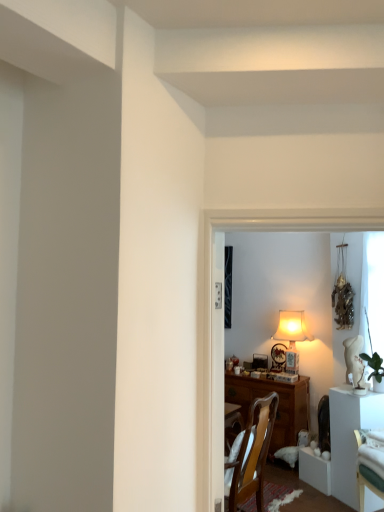
The image size is (384, 512). What do you see at coordinates (350, 437) in the screenshot? I see `white glossy table at right` at bounding box center [350, 437].

Where is `white glossy table at right`? white glossy table at right is located at coordinates (350, 437).

Measure the distance between white glossy table at right and camera.

3.02 meters.

This screenshot has height=512, width=384. Describe the element at coordinates (374, 365) in the screenshot. I see `green leafy plant at right` at that location.

The width and height of the screenshot is (384, 512). I want to click on green leafy plant at right, so click(374, 365).

In order to click on white glossy table at right in this screenshot , I will do `click(350, 437)`.

Visually, is green leafy plant at right positioned to the left or to the right of white glossy table at right?

From the image, it's evident that green leafy plant at right is to the right of white glossy table at right.

Between green leafy plant at right and white glossy table at right, which one is positioned behind?

Positioned behind is green leafy plant at right.

In the scene shown: Which is farther, (382, 362) or (344, 488)?

Positioned behind is point (344, 488).

From the image's perspective, which object appears higher, green leafy plant at right or white glossy table at right?

green leafy plant at right is shown above in the image.

From a real-world perspective, is green leafy plant at right positioned under white glossy table at right based on gravity?

No, from a real-world perspective, green leafy plant at right is not under white glossy table at right.

Between green leafy plant at right and white glossy table at right, which one has larger width?

With larger width is white glossy table at right.

Between green leafy plant at right and white glossy table at right, which one has more height?

white glossy table at right is taller.

In the scene shown: Between green leafy plant at right and white glossy table at right, which one has larger size?

With larger size is white glossy table at right.

Is green leafy plant at right spatially inside white glossy table at right, or outside of it?

The correct answer is: outside.

From the picture: Is green leafy plant at right next to white glossy table at right and touching it?

There is a gap between green leafy plant at right and white glossy table at right.

Is white glossy table at right at the back of green leafy plant at right?

No, green leafy plant at right is not facing the opposite direction of white glossy table at right.

In order to click on table directly beneath the green leafy plant at right (from a real-world perspective) in this screenshot , I will do `click(350, 437)`.

Is white glossy table at right to the right of green leafy plant at right from the viewer's perspective?

In fact, white glossy table at right is to the left of green leafy plant at right.

Is white glossy table at right positioned in front of green leafy plant at right?

Yes, white glossy table at right is in front of green leafy plant at right.

Considering the positions of point (336, 469) and point (382, 368), is point (336, 469) closer or farther from the camera than point (382, 368)?

Point (336, 469).

From the image's perspective, is white glossy table at right located beneath green leafy plant at right?

Yes.

From a real-world perspective, is white glossy table at right physically located above or below green leafy plant at right?

From a real-world perspective, white glossy table at right is physically below green leafy plant at right.

Considering the sizes of objects white glossy table at right and green leafy plant at right in the image provided, who is thinner, white glossy table at right or green leafy plant at right?

Thinner between the two is green leafy plant at right.

Considering the relative sizes of white glossy table at right and green leafy plant at right in the image provided, is white glossy table at right shorter than green leafy plant at right?

No, white glossy table at right is not shorter than green leafy plant at right.

Considering the sizes of white glossy table at right and green leafy plant at right in the image, is white glossy table at right bigger or smaller than green leafy plant at right?

Clearly, white glossy table at right is larger in size than green leafy plant at right.

Would you say white glossy table at right is outside green leafy plant at right?

Yes, white glossy table at right is outside of green leafy plant at right.

Is white glossy table at right not close to green leafy plant at right?

No, there isn't a large distance between white glossy table at right and green leafy plant at right.

Is white glossy table at right positioned with its back to green leafy plant at right?

No, white glossy table at right is not facing the opposite direction of green leafy plant at right.

Can you tell me how much white glossy table at right and green leafy plant at right differ in facing direction?

They differ by 0.0014 degrees in their facing directions.

Identify the location of table on the left of green leafy plant at right. This screenshot has height=512, width=384. (350, 437).

Identify the location of table that appears below the green leafy plant at right (from the image's perspective). (350, 437).

Where is `table that is on the left side of green leafy plant at right`? table that is on the left side of green leafy plant at right is located at coordinates (350, 437).